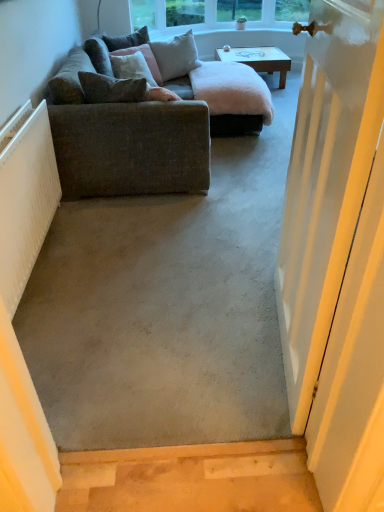
Question: From a real-world perspective, relative to light gray fabric pillow at upper center, which is counted as the third pillow, starting from the front, is white ribbed radiator at left vertically above or below?

Choices:
 (A) above
 (B) below

Answer: (B)

Question: Choose the correct answer: Is white ribbed radiator at left inside light gray fabric pillow at upper center, positioned as the 2th pillow in back-to-front order, or outside it?

Choices:
 (A) outside
 (B) inside

Answer: (A)

Question: Estimate the real-world distances between objects in this image. Which object is closer to the light gray fabric pillow at upper center, which is counted as the third pillow, starting from the front?

Choices:
 (A) textured gray couch at left
 (B) wooden coffee table at center
 (C) velvet green pillow at upper left, the 1th pillow in the back-to-front sequence
 (D) velvet brown pillow at upper left, which is the 3th pillow from back to front
 (E) white painted wood door at right

Answer: (D)

Question: Which object is the closest to the white ribbed radiator at left?

Choices:
 (A) velvet green pillow at upper left, the fourth pillow from the front
 (B) textured gray pillow at left, which ranks as the 4th pillow in back-to-front order
 (C) light gray fabric pillow at upper center, positioned as the 2th pillow in back-to-front order
 (D) white painted wood door at right
 (E) textured gray couch at left

Answer: (E)